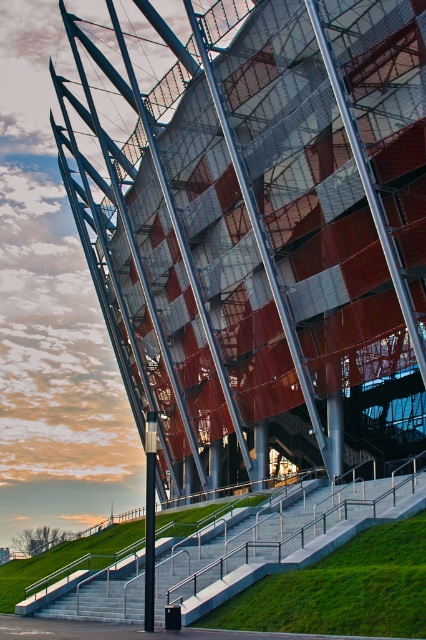
Question: Does metallic red and gray stadium at center appear on the left side of concrete stairs at lower left?

Choices:
 (A) no
 (B) yes

Answer: (B)

Question: Where is metallic red and gray stadium at center located in relation to concrete stairs at lower left in the image?

Choices:
 (A) left
 (B) right

Answer: (A)

Question: Which point is farther to the camera?

Choices:
 (A) metallic red and gray stadium at center
 (B) concrete stairs at lower left

Answer: (A)

Question: Does metallic red and gray stadium at center appear under concrete stairs at lower left?

Choices:
 (A) yes
 (B) no

Answer: (B)

Question: Which object appears closest to the camera in this image?

Choices:
 (A) metallic red and gray stadium at center
 (B) concrete stairs at lower left

Answer: (B)